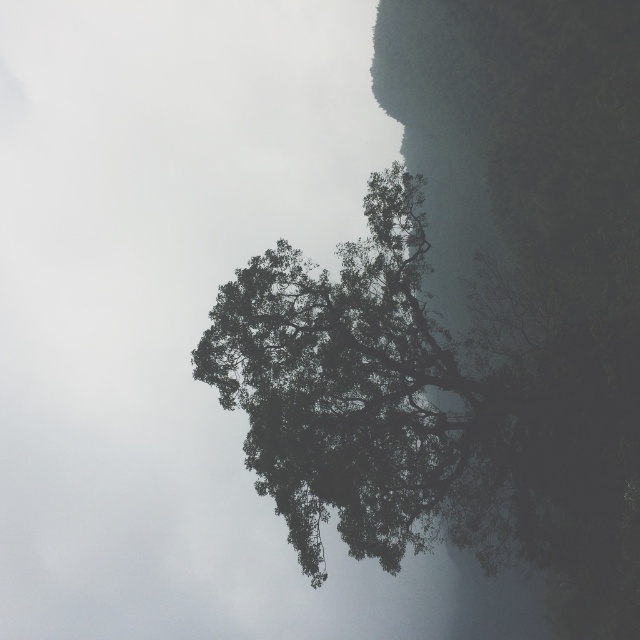
Which is in front, point (440, 172) or point (397, 180)?

Point (397, 180) is in front.

Does dark green textured cliff at center appear under dark green leafy tree at center?

No.

Locate an element on the screen. Image resolution: width=640 pixels, height=640 pixels. dark green textured cliff at center is located at coordinates (538, 269).

This screenshot has height=640, width=640. I want to click on dark green textured cliff at center, so click(538, 269).

Which is more to the right, transparent fog at center or dark green leafy tree at center?

From the viewer's perspective, dark green leafy tree at center appears more on the right side.

Does point (120, 1) come farther from viewer compared to point (451, 464)?

Yes, it is behind point (451, 464).

Is point (337, 163) positioned behind point (464, 536)?

That is True.

Where is `transparent fog at center`? The image size is (640, 640). transparent fog at center is located at coordinates (164, 307).

Does transparent fog at center have a greater width compared to dark green textured cliff at center?

Yes.

In the scene shown: Does transparent fog at center appear over dark green textured cliff at center?

Yes.

In the scene shown: Measure the distance between transparent fog at center and camera.

The distance of transparent fog at center from camera is 192.55 meters.

The width and height of the screenshot is (640, 640). I want to click on transparent fog at center, so click(164, 307).